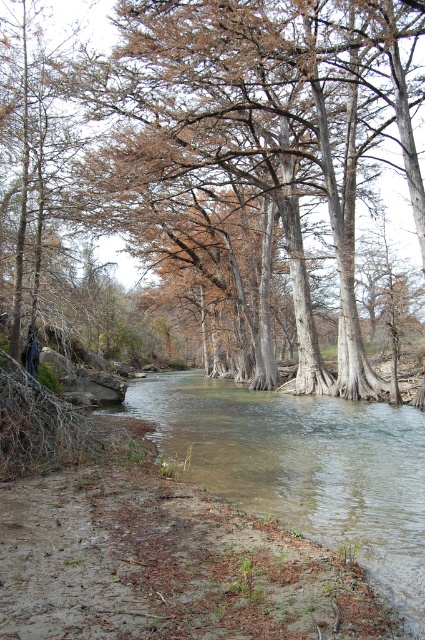
Question: Which point is closer to the camera taking this photo?

Choices:
 (A) (339, 97)
 (B) (388, 449)

Answer: (B)

Question: Is brown wood tree at center below clear water at center?

Choices:
 (A) no
 (B) yes

Answer: (A)

Question: Among these objects, which one is farthest from the camera?

Choices:
 (A) brown wood tree at center
 (B) clear water at center

Answer: (A)

Question: Does brown wood tree at center appear under clear water at center?

Choices:
 (A) no
 (B) yes

Answer: (A)

Question: Can you confirm if brown wood tree at center is thinner than clear water at center?

Choices:
 (A) yes
 (B) no

Answer: (B)